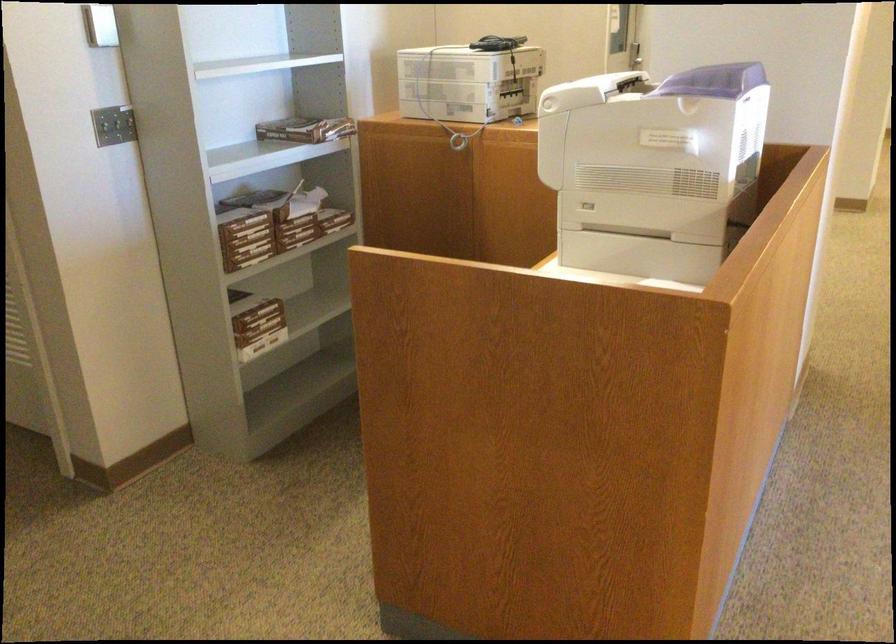
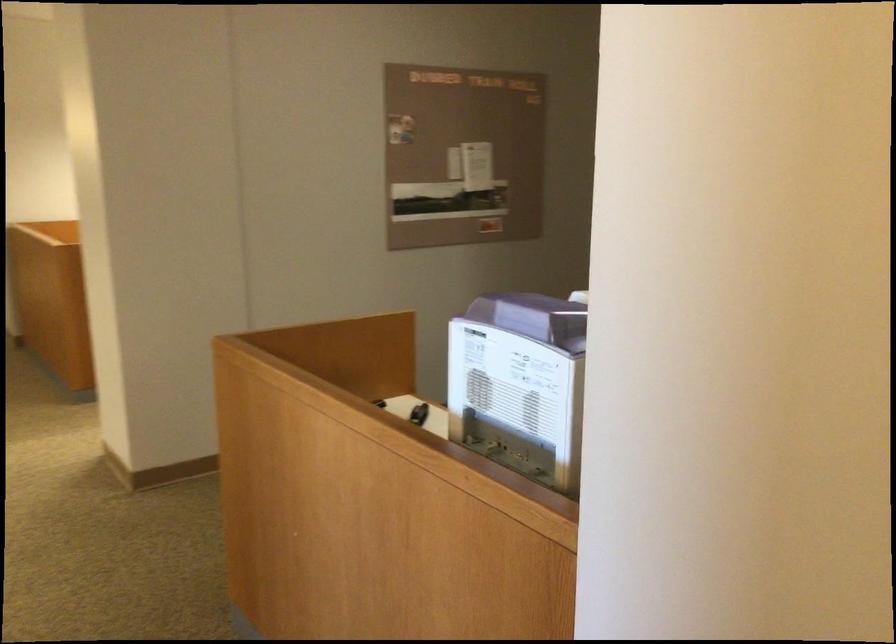
Question: I am providing you with two images of the same scene from different viewpoints. Please identify which objects are invisible in image2.

Choices:
 (A) purple machine lid
 (B) ream of paper
 (C) yellow tin can
 (D) small black object

Answer: (B)